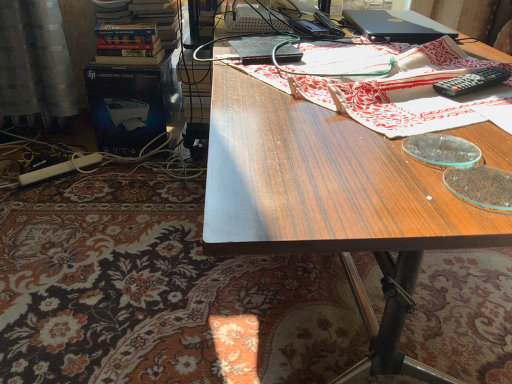
The height and width of the screenshot is (384, 512). What are the coordinates of `free location in front of black matte laptop at upper right` in the screenshot? It's located at (400, 50).